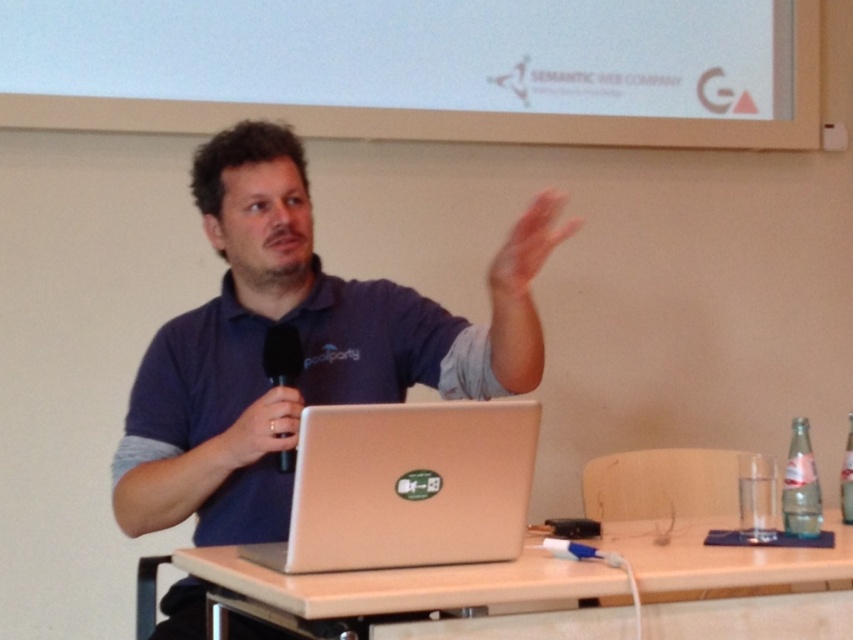
You are a photographer positioned in front of the podium. You want to take a closeup shot of the man without moving your camera. Can you focus on the pink flesh at upper center from your current position?

The distance of pink flesh at upper center from camera is 1.55 meters, so yes, you can focus on the pink flesh at upper center from your current position as it is within the camera focus range.

Based on the coordinates provided, where is the satin gold laptop at center located in the image?

The satin gold laptop at center is located at the coordinates point (407,486).

You are organizing a presentation and need to place both the satin gold laptop at center and the black matte microphone at center on a narrow table. Based on their sizes, which one should you place first to ensure both fit?

The satin gold laptop at center is wider than the black matte microphone at center, so you should place the narrower microphone first to accommodate the wider laptop afterward.